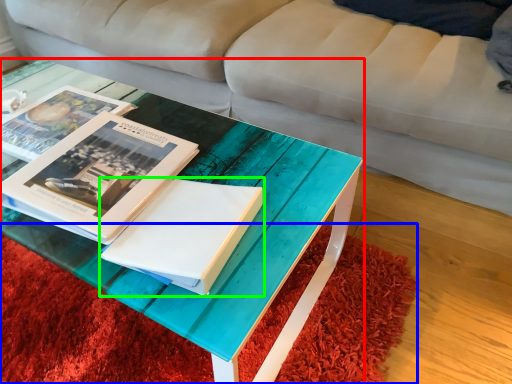
Question: Considering the real-world distances, which object is farthest from coffee table (highlighted by a red box)? mat (highlighted by a blue box) or paperback book (highlighted by a green box)?

Choices:
 (A) mat
 (B) paperback book

Answer: (A)